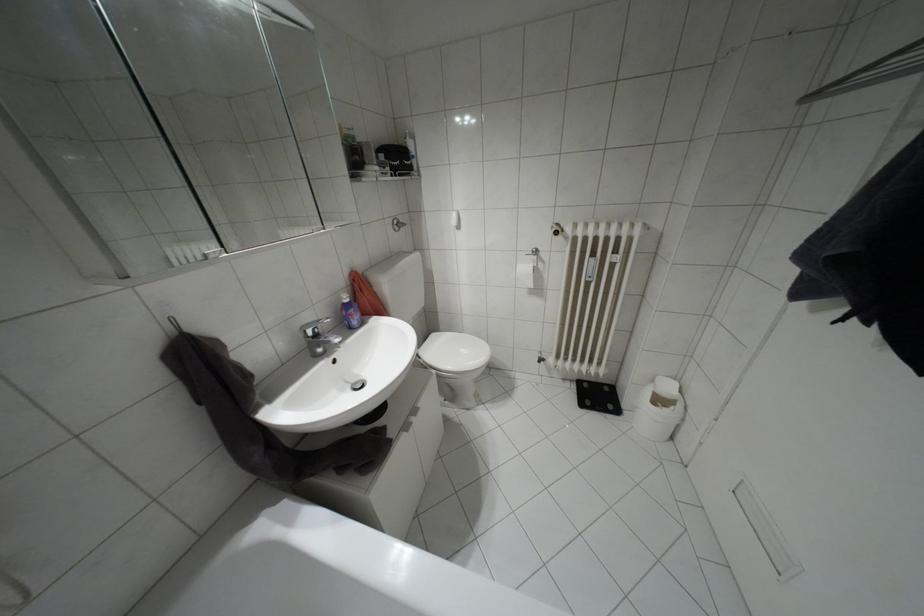
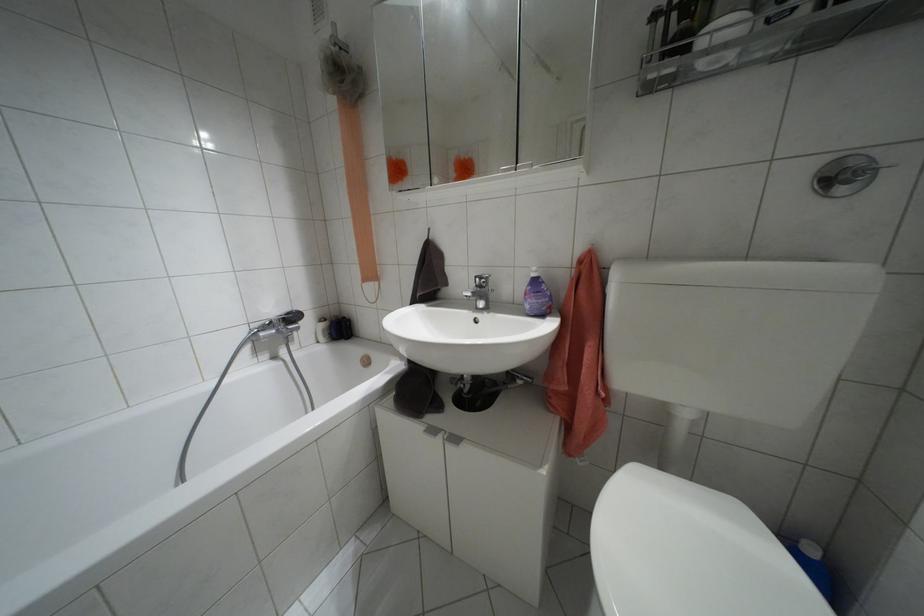
Locate, in the second image, the point that corresponds to [395,229] in the first image.

(841, 190)